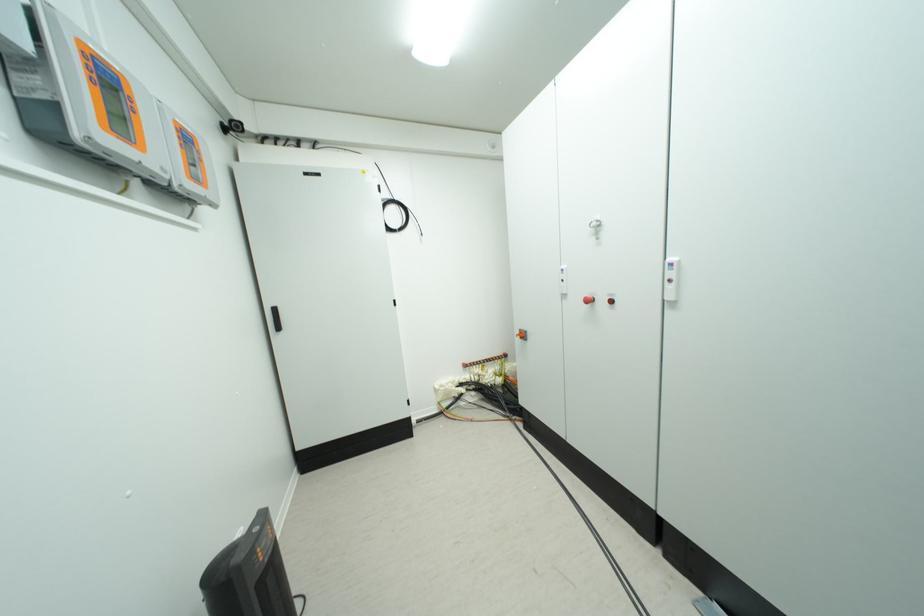
Locate an element on the screen. The width and height of the screenshot is (924, 616). black cabinet handle is located at coordinates (275, 318).